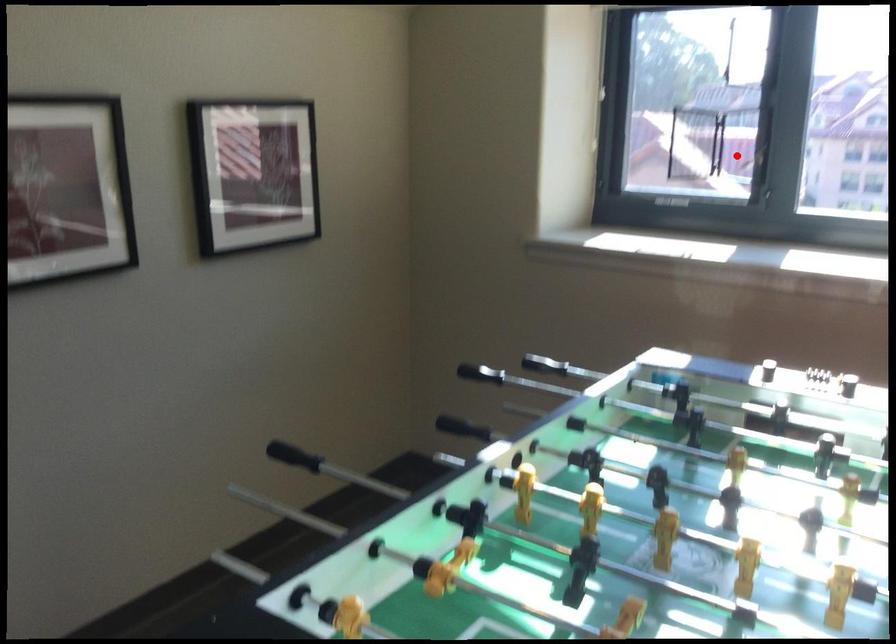
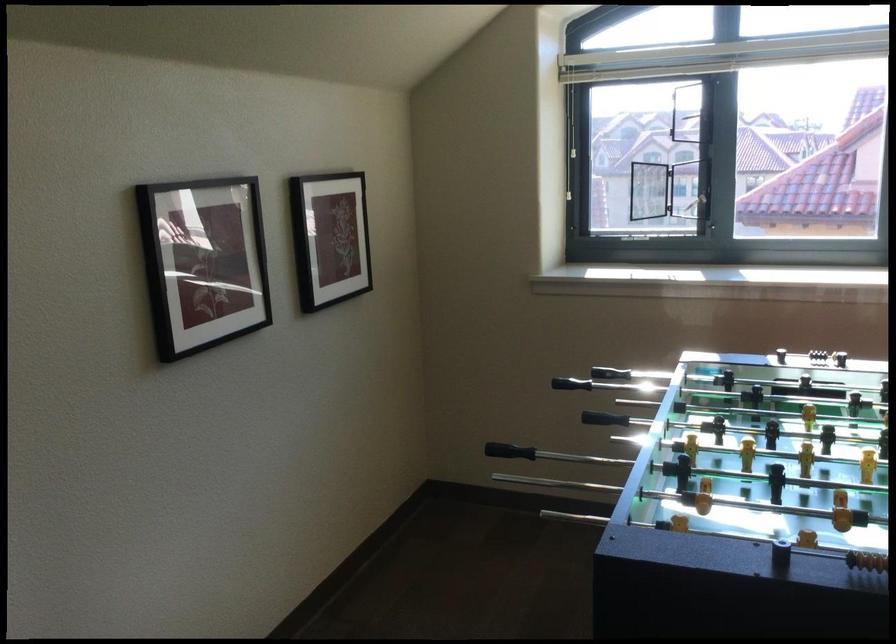
In the second image, find the point that corresponds to the highlighted location in the first image.

(688, 189)